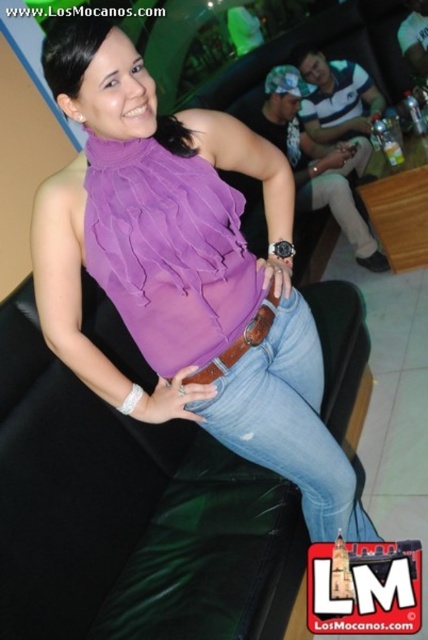
Question: Can you confirm if purple chiffon blouse at center is positioned below jeans at center?

Choices:
 (A) no
 (B) yes

Answer: (A)

Question: Which object is farther from the camera taking this photo?

Choices:
 (A) brown leather belt at center
 (B) jeans at center

Answer: (A)

Question: In this image, where is purple chiffon blouse at center located relative to brown leather belt at center?

Choices:
 (A) left
 (B) right

Answer: (B)

Question: Which of these objects is positioned closest to the brown leather belt at center?

Choices:
 (A) purple chiffon blouse at center
 (B) jeans at center

Answer: (B)

Question: Which of these objects is positioned closest to the jeans at center?

Choices:
 (A) brown leather belt at center
 (B) purple chiffon blouse at center

Answer: (B)

Question: Is purple chiffon blouse at center to the right of jeans at center from the viewer's perspective?

Choices:
 (A) yes
 (B) no

Answer: (B)